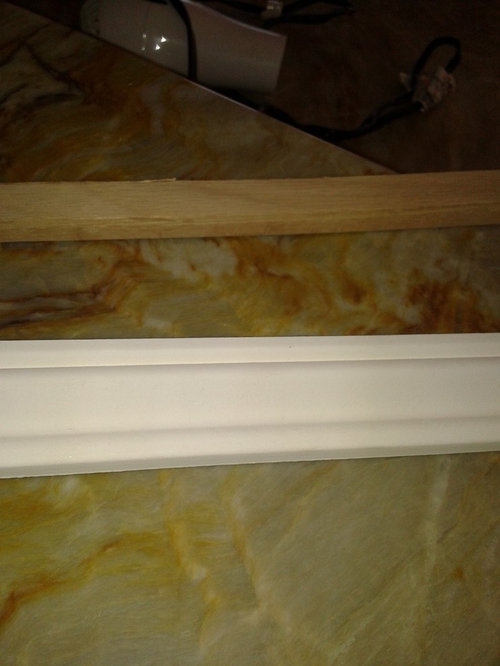
Locate an element on the screen. edge of benchtop is located at coordinates (355, 154).